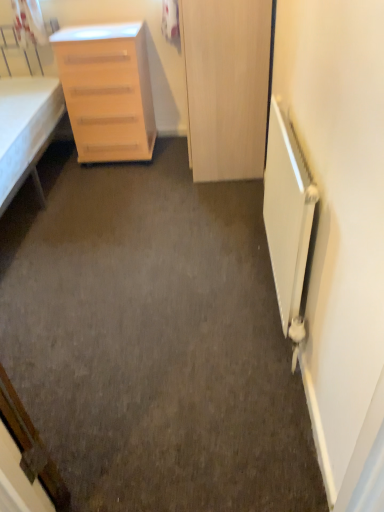
Image resolution: width=384 pixels, height=512 pixels. I want to click on free space to the left of white matte radiator at right, so click(x=180, y=297).